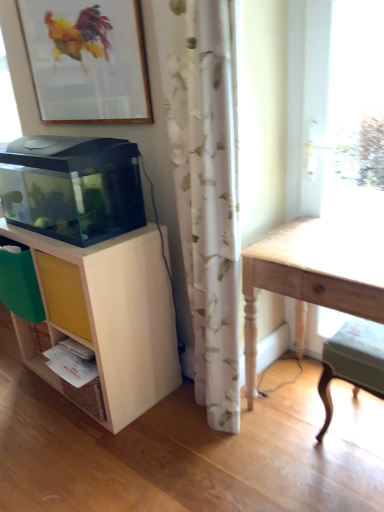
The height and width of the screenshot is (512, 384). In order to click on wooden framed picture at upper left in this screenshot , I will do `click(87, 60)`.

I want to click on matte wood shelf at left, so click(x=105, y=320).

Where is `light green fabric step stool at lower right`? This screenshot has width=384, height=512. light green fabric step stool at lower right is located at coordinates (353, 362).

Measure the distance between light green fabric step stool at lower right and camera.

light green fabric step stool at lower right is 4.30 feet away from camera.

Find the location of a particular element. The width and height of the screenshot is (384, 512). transparent glass aquarium at left is located at coordinates (72, 187).

Based on their sizes in the image, would you say light green fabric step stool at lower right is bigger or smaller than white floral curtain at center?

In the image, light green fabric step stool at lower right appears to be smaller than white floral curtain at center.

From a real-world perspective, is light green fabric step stool at lower right over white floral curtain at center?

No, from a real-world perspective, light green fabric step stool at lower right is not above white floral curtain at center.

You are a GUI agent. You are given a task and a screenshot of the screen. Output one action in this format:
    pyautogui.click(x=<x>, y=<y>)
    Task: Click on the curtain above the light green fabric step stool at lower right (from the image's perspective)
    This screenshot has height=512, width=384.
    Given the screenshot: What is the action you would take?
    pyautogui.click(x=207, y=190)

From the image's perspective, is matte wood shelf at left beneath light wood table at right?

Incorrect, from the image's perspective, matte wood shelf at left is higher than light wood table at right.

In terms of width, does matte wood shelf at left look wider or thinner when compared to light wood table at right?

Considering their sizes, matte wood shelf at left looks slimmer than light wood table at right.

Which is more to the left, matte wood shelf at left or light wood table at right?

matte wood shelf at left.

Identify the location of picture frame above the transparent glass aquarium at left (from a real-world perspective). (87, 60).

Looking at this image, from a real-world perspective, is transparent glass aquarium at left beneath wooden framed picture at upper left?

Indeed, from a real-world perspective, transparent glass aquarium at left is positioned beneath wooden framed picture at upper left.

Who is taller, transparent glass aquarium at left or wooden framed picture at upper left?

With more height is wooden framed picture at upper left.

How many degrees apart are the facing directions of transparent glass aquarium at left and wooden framed picture at upper left?

3.28 degrees.

From a real-world perspective, is wooden framed picture at upper left physically located above or below matte wood shelf at left?

From a real-world perspective, wooden framed picture at upper left is physically above matte wood shelf at left.

Looking at this image, is wooden framed picture at upper left completely or partially outside of matte wood shelf at left?

wooden framed picture at upper left is positioned outside matte wood shelf at left.

Is wooden framed picture at upper left directly adjacent to matte wood shelf at left?

They are not placed beside each other.

Which is closer to the camera, (50, 32) or (137, 379)?

Point (50, 32) is farther from the camera than point (137, 379).

From a real-world perspective, is matte wood shelf at left physically above white floral curtain at center?

No, from a real-world perspective, matte wood shelf at left is not on top of white floral curtain at center.

Is matte wood shelf at left at the right side of white floral curtain at center?

Incorrect, matte wood shelf at left is not on the right side of white floral curtain at center.

Is matte wood shelf at left not within white floral curtain at center?

Yes.

Who is more distant, matte wood shelf at left or white floral curtain at center?

matte wood shelf at left is further from the camera.

In terms of width, does white floral curtain at center look wider or thinner when compared to wooden framed picture at upper left?

white floral curtain at center is wider than wooden framed picture at upper left.

From a real-world perspective, between white floral curtain at center and wooden framed picture at upper left, who is vertically lower?

white floral curtain at center.

Is white floral curtain at center looking in the opposite direction of wooden framed picture at upper left?

No.

Considering the positions of points (195, 207) and (91, 60), is point (195, 207) farther from camera compared to point (91, 60)?

No, it is not.

Does transparent glass aquarium at left have a greater height compared to white floral curtain at center?

No, transparent glass aquarium at left is not taller than white floral curtain at center.

Are transparent glass aquarium at left and white floral curtain at center beside each other?

transparent glass aquarium at left and white floral curtain at center are not in contact.

Where is `appliance behind the white floral curtain at center`? appliance behind the white floral curtain at center is located at coordinates (72, 187).

Where is `step stool that is behind the white floral curtain at center`? step stool that is behind the white floral curtain at center is located at coordinates (353, 362).

Where is `table that appears in front of the matte wood shelf at left`? The image size is (384, 512). table that appears in front of the matte wood shelf at left is located at coordinates (314, 275).

From the image, which object appears to be nearer to wooden framed picture at upper left, matte wood shelf at left or transparent glass aquarium at left?

transparent glass aquarium at left is positioned closer to the anchor wooden framed picture at upper left.

Based on their spatial positions, is light green fabric step stool at lower right or light wood table at right closer to yellow matte drawer at lower left?

light wood table at right is positioned closer to the anchor yellow matte drawer at lower left.

From the image, which object appears to be nearer to matte wood shelf at left, light wood table at right or transparent glass aquarium at left?

The object closer to matte wood shelf at left is transparent glass aquarium at left.

Looking at the image, which one is located closer to wooden framed picture at upper left, yellow matte drawer at lower left or light wood table at right?

yellow matte drawer at lower left lies closer to wooden framed picture at upper left than the other object.

Considering their positions, is matte wood shelf at left positioned further to yellow matte drawer at lower left than wooden framed picture at upper left?

The object further to yellow matte drawer at lower left is wooden framed picture at upper left.

Estimate the real-world distances between objects in this image. Which object is further from light wood table at right, white floral curtain at center or light green fabric step stool at lower right?

white floral curtain at center is further to light wood table at right.

From the image, which object appears to be farther from light wood table at right, transparent glass aquarium at left or wooden framed picture at upper left?

wooden framed picture at upper left lies further to light wood table at right than the other object.

From the image, which object appears to be nearer to yellow matte drawer at lower left, wooden framed picture at upper left or light wood table at right?

The object closer to yellow matte drawer at lower left is light wood table at right.

The image size is (384, 512). Find the location of `curtain between wooden framed picture at upper left and light wood table at right vertically`. curtain between wooden framed picture at upper left and light wood table at right vertically is located at coordinates (207, 190).

This screenshot has width=384, height=512. Identify the location of curtain between wooden framed picture at upper left and yellow matte drawer at lower left vertically. pyautogui.click(x=207, y=190).

This screenshot has height=512, width=384. Identify the location of drawer situated between matte wood shelf at left and light green fabric step stool at lower right from left to right. (63, 294).

Locate an element on the screen. This screenshot has height=512, width=384. picture frame situated between transparent glass aquarium at left and light wood table at right from left to right is located at coordinates (x=87, y=60).